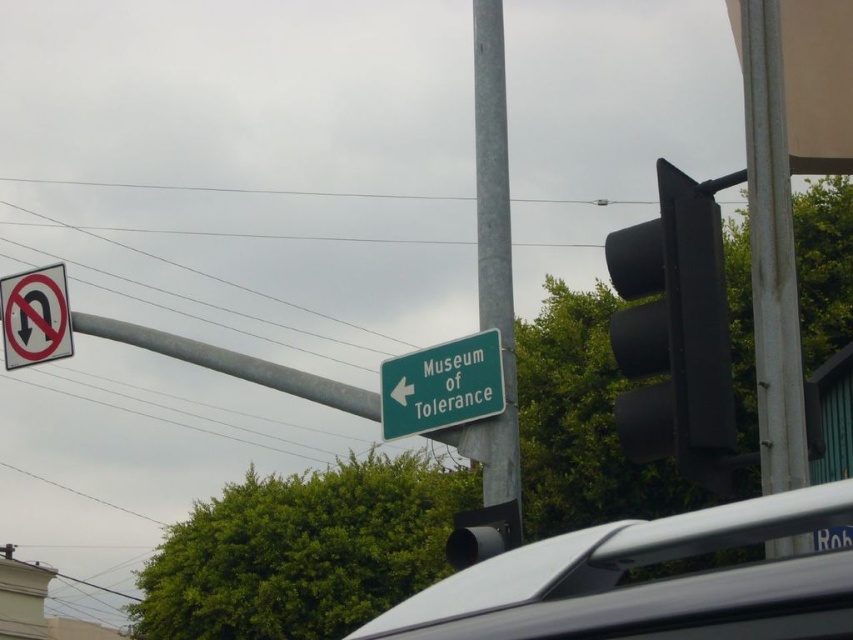
You are a pedestrian trying to find the Museum of Tolerance. You see a green matte sign at center and a white plastic sign at upper left. Which direction should you go based on their positions?

The green matte sign at center is to the right of the white plastic sign at upper left, so you should go towards the right direction from the white plastic sign at upper left to find the Museum of Tolerance.

You are a delivery robot with a height of 1.5 meters. You are standing in the street scene and need to reach a delivery point located at point (753, 534). Can you safely reach this point without hitting your head?

The distance of point (753, 534) from camera is 2.11 meters. Since the robot is 1.5 meters tall and the point is 2.11 meters away, the robot can safely reach the point without hitting its head as the vertical clearance is sufficient.

Looking at this image, you are a delivery driver who needs to make a tight turn around a corner. You see the green matte sign at center and the white plastic sign at upper left. Which sign can you keep closer to while making the turn without risking collision?

The green matte sign at center has a lesser width compared to the white plastic sign at upper left, so you can keep closer to the green matte sign at center during the turn as it is narrower and poses less collision risk.